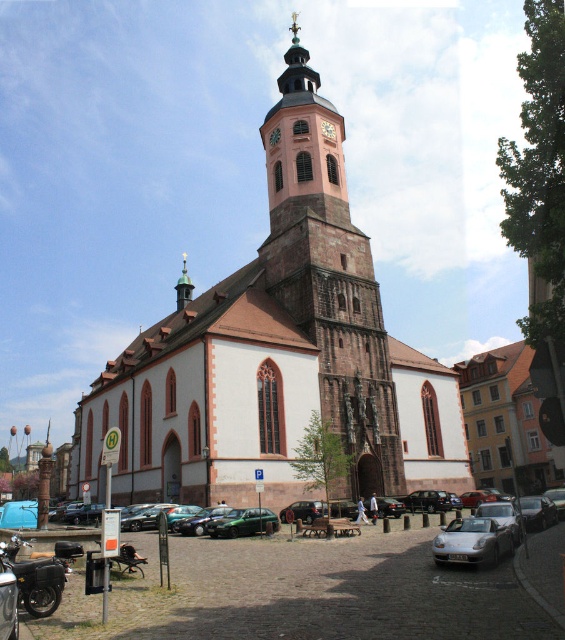
Does shiny black motorcycle at lower left have a greater height compared to satin silver car at lower center?

Yes, shiny black motorcycle at lower left is taller than satin silver car at lower center.

Does shiny black motorcycle at lower left have a larger size compared to satin silver car at lower center?

Yes.

This screenshot has height=640, width=565. What are the coordinates of `shiny black motorcycle at lower left` in the screenshot? It's located at (37, 576).

Is metallic silver car at center bigger than gold plated spire at upper center?

→ No.

Is point (301, 508) positioned before point (182, 275)?

Yes, it is in front of point (182, 275).

The image size is (565, 640). What do you see at coordinates (303, 509) in the screenshot? I see `metallic silver car at center` at bounding box center [303, 509].

I want to click on metallic silver car at center, so click(303, 509).

Does shiny black motorcycle at lower left appear on the right side of metallic silver car at center?

No, shiny black motorcycle at lower left is not to the right of metallic silver car at center.

Does shiny black motorcycle at lower left have a smaller size compared to metallic silver car at center?

No, shiny black motorcycle at lower left is not smaller than metallic silver car at center.

Is point (8, 557) behind point (289, 506)?

No, it is not.

What are the coordinates of `shiny black motorcycle at lower left` in the screenshot? It's located at (37, 576).